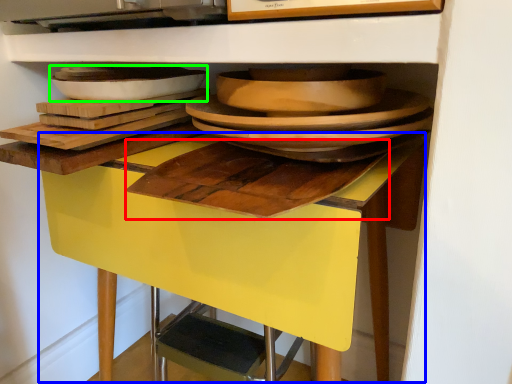
Question: Considering the real-world distances, which object is farthest from cutting board (highlighted by a red box)? table (highlighted by a blue box) or platter (highlighted by a green box)?

Choices:
 (A) table
 (B) platter

Answer: (B)